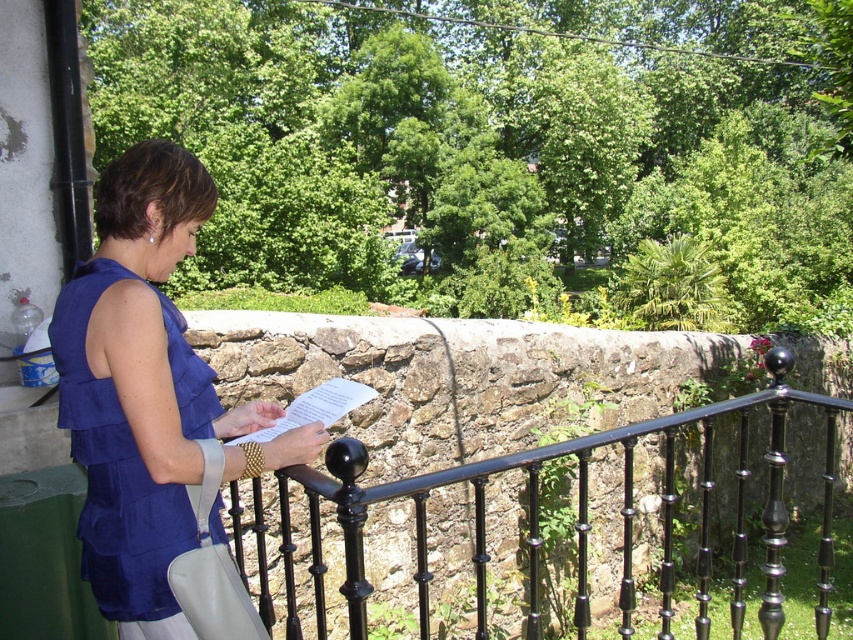
Question: Is black wrought iron railing at center to the right of matte blue blouse at center from the viewer's perspective?

Choices:
 (A) yes
 (B) no

Answer: (A)

Question: Among these objects, which one is farthest from the camera?

Choices:
 (A) matte blue blouse at center
 (B) black wrought iron railing at center

Answer: (B)

Question: Which point is farther to the camera?

Choices:
 (A) black wrought iron railing at center
 (B) matte blue blouse at center

Answer: (A)

Question: Does black wrought iron railing at center have a lesser width compared to matte blue blouse at center?

Choices:
 (A) yes
 (B) no

Answer: (B)

Question: Does black wrought iron railing at center lie behind matte blue blouse at center?

Choices:
 (A) no
 (B) yes

Answer: (B)